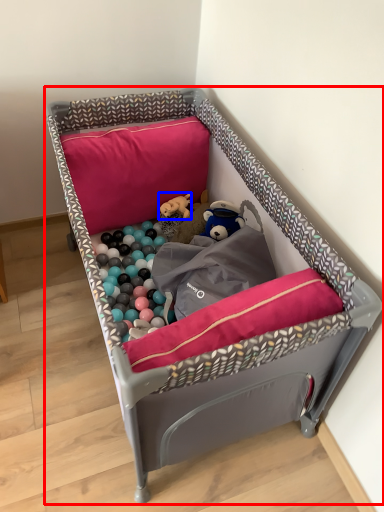
Question: Which of the following is the closest to the observer, infant bed (highlighted by a red box) or toy (highlighted by a blue box)?

Choices:
 (A) infant bed
 (B) toy

Answer: (A)